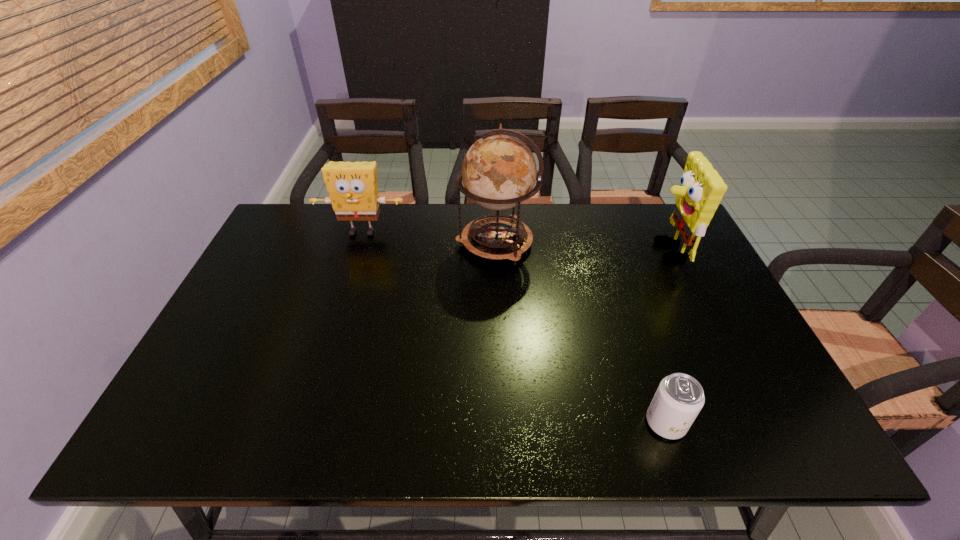
Find the location of `vacant space located 0.340m at the center of the tallest object`. vacant space located 0.340m at the center of the tallest object is located at coordinates click(x=346, y=242).

Find the location of a particular element. vacant space situated on the face of the right sponge is located at coordinates (634, 252).

This screenshot has width=960, height=540. What are the coordinates of `free space located 0.190m on the face of the right sponge` in the screenshot? It's located at (588, 252).

Find the location of a particular element. This screenshot has width=960, height=540. vacant space located 0.240m on the face of the right sponge is located at coordinates (570, 252).

Where is `free region located on the face of the leftmost object`? This screenshot has width=960, height=540. free region located on the face of the leftmost object is located at coordinates (329, 334).

I want to click on blank space located on the back of the nearest object, so click(621, 288).

Find the location of a particular element. This screenshot has height=540, width=960. globe located in the far edge section of the desktop is located at coordinates pyautogui.click(x=499, y=171).

This screenshot has height=540, width=960. Identify the location of object that is at the near edge. (679, 398).

Find the location of a particular element. The height and width of the screenshot is (540, 960). object positioned at the left edge is located at coordinates (352, 186).

Locate an element on the screen. object located at the right edge is located at coordinates (701, 189).